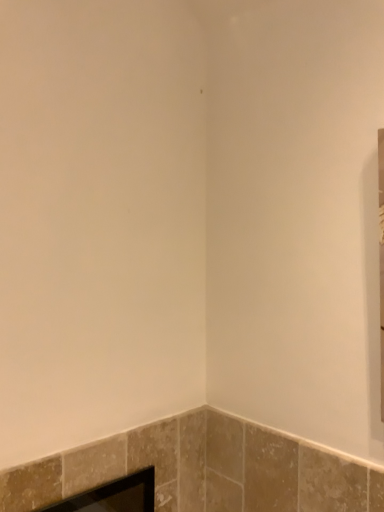
Image resolution: width=384 pixels, height=512 pixels. I want to click on matte black fireplace at lower left, so click(113, 496).

The image size is (384, 512). What do you see at coordinates (113, 496) in the screenshot? I see `matte black fireplace at lower left` at bounding box center [113, 496].

Find the location of a particular element. This screenshot has width=384, height=512. matte black fireplace at lower left is located at coordinates (113, 496).